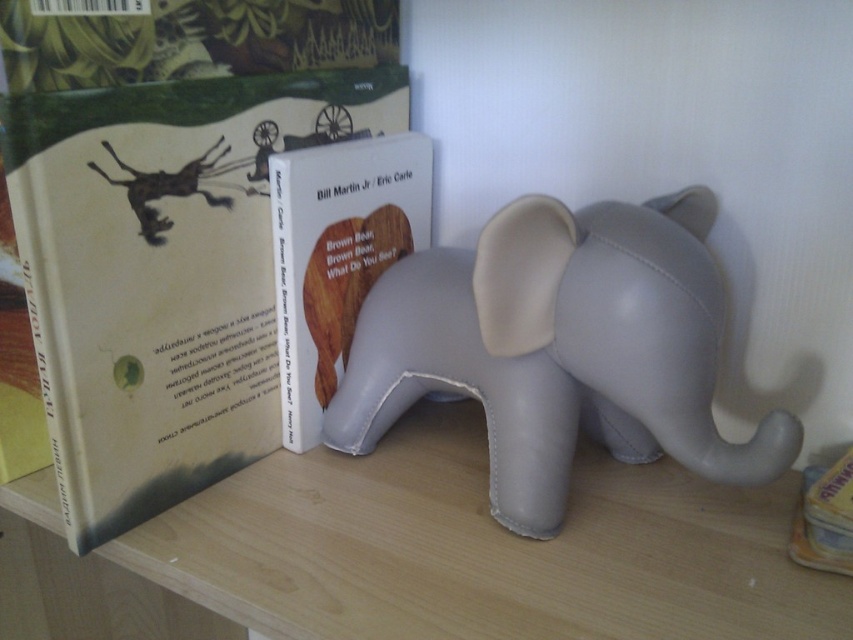
Question: Estimate the real-world distances between objects in this image. Which object is farther from the gray matte elephant at center?

Choices:
 (A) white paper at center
 (B) matte white book at center

Answer: (A)

Question: In this image, where is gray matte elephant at center located relative to matte white book at center?

Choices:
 (A) left
 (B) right

Answer: (B)

Question: Which object is farther from the camera taking this photo?

Choices:
 (A) white paper at center
 (B) gray matte elephant at center

Answer: (B)

Question: Considering the relative positions of white paper at center and gray matte elephant at center in the image provided, where is white paper at center located with respect to gray matte elephant at center?

Choices:
 (A) left
 (B) right

Answer: (A)

Question: Which object is positioned closest to the gray matte elephant at center?

Choices:
 (A) white paper at center
 (B) matte white book at center

Answer: (B)

Question: Observing the image, what is the correct spatial positioning of white paper at center in reference to gray matte elephant at center?

Choices:
 (A) left
 (B) right

Answer: (A)